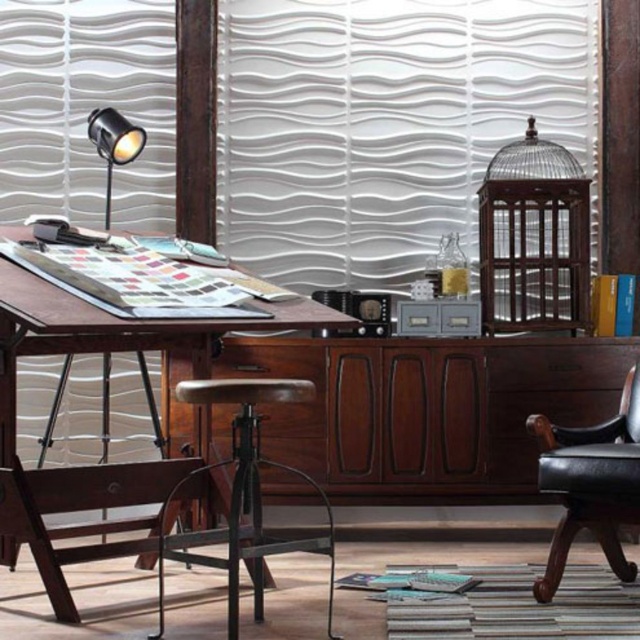
Question: Estimate the real-world distances between objects in this image. Which object is closer to the black leather armchair at lower right?

Choices:
 (A) matte black spotlight at upper left
 (B) rustic wood stool at center

Answer: (B)

Question: Which of the following is the closest to the observer?

Choices:
 (A) matte black spotlight at upper left
 (B) black leather armchair at lower right

Answer: (B)

Question: Is wooden swivel chair at lower left to the left of black leather armchair at lower right from the viewer's perspective?

Choices:
 (A) no
 (B) yes

Answer: (B)

Question: Is wooden swivel chair at lower left thinner than black leather armchair at lower right?

Choices:
 (A) yes
 (B) no

Answer: (B)

Question: Observing the image, what is the correct spatial positioning of wooden drafting table at left in reference to matte black spotlight at upper left?

Choices:
 (A) below
 (B) above

Answer: (A)

Question: Among these points, which one is nearest to the camera?

Choices:
 (A) (548, 452)
 (B) (257, 620)
 (C) (195, 339)

Answer: (B)